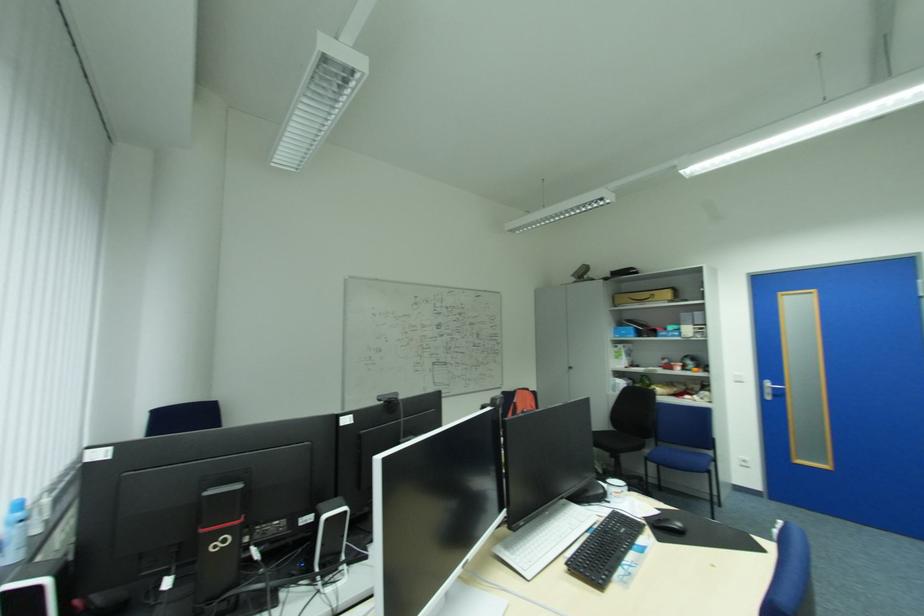
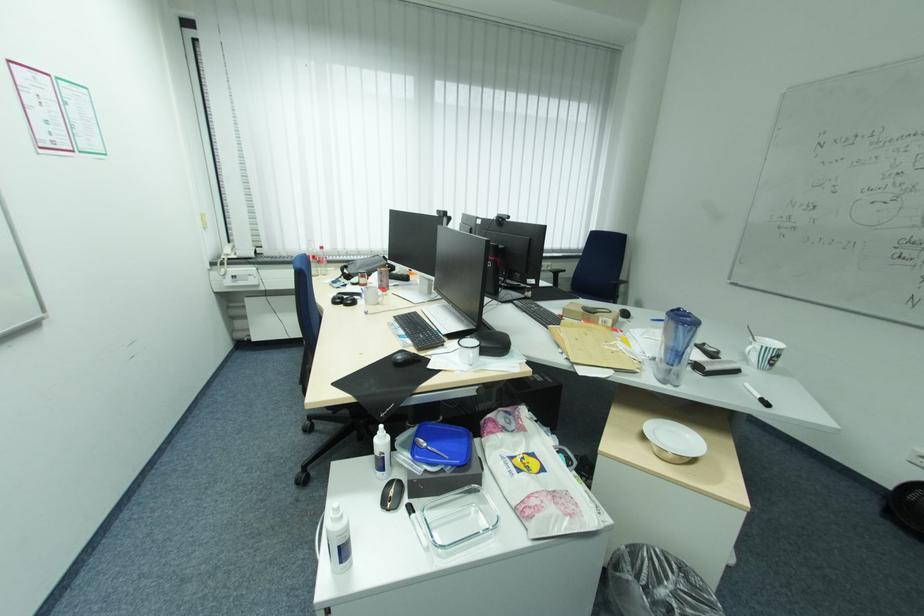
The point at [631,564] is marked in the first image. Where is the corresponding point in the second image?

(407, 329)